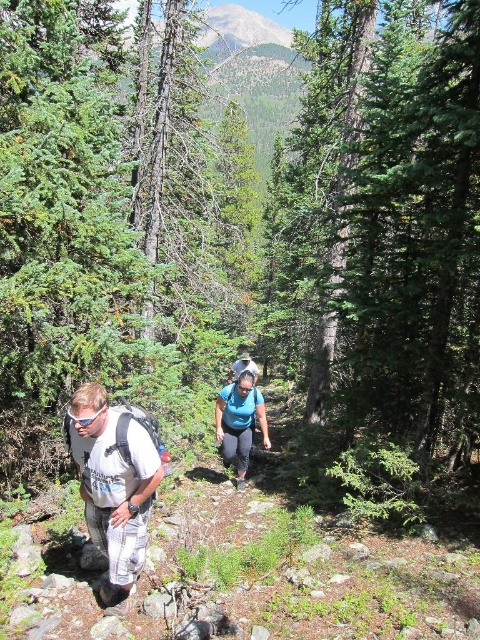
You are a hiker observing the scene. You notice the white mesh backpack at lower left and the blue fabric shirt at center. Which object is closer to the bottom edge of the image?

The white mesh backpack at lower left is closer to the bottom edge of the image because it is shorter than the blue fabric shirt at center.

You are a hiker who wants to know the exact position of your white mesh backpack at lower left in the image. According to the coordinates provided, what are its 2D coordinates?

The white mesh backpack at lower left is located at the 2D coordinates point (116, 483).

You are a hiker on the trail and notice two items in your line of sight. One is a blue fabric shirt at center and the other is matte black goggles at lower left. Which item is located to the right when viewed from your perspective?

The blue fabric shirt at center is located to the right of the matte black goggles at lower left.